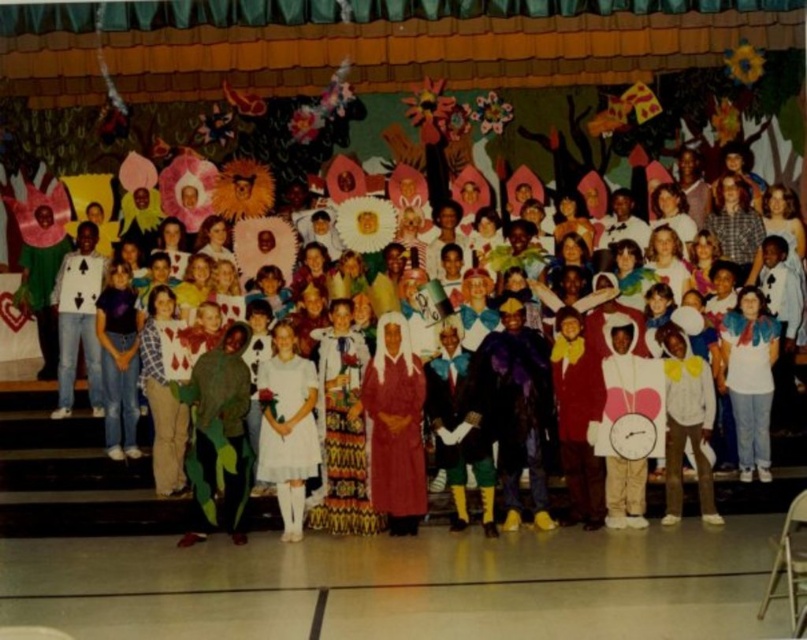
You are a photographer standing at the front of the stage. You want to take a photo of the white cotton dress at center. Where should you aim your camera to capture it?

The white cotton dress at center is located at position point [70,474], so you should aim your camera at that coordinate to capture it.

You are a photographer trying to capture a group photo of the children on stage. You notice two white dresses at the center of the group. Which dress has a wider silhouette? The options are the white cotton dress at center and the white satin dress at center.

The white cotton dress at center has a larger width than the white satin dress at center, so it has a wider silhouette.

You are a photographer standing at the back of the stage. You want to take a photo of both the white cotton dress at center and the white satin dress at center so that they are both clearly visible in the frame. Given their distance apart, is it possible to capture both in a single shot without zooming in?

The white cotton dress at center and the white satin dress at center are 5.34 feet apart. Since they are positioned close enough within the stage, a photographer can likely capture both in a single shot without zooming in, provided the camera has a wide enough lens to accommodate the 5.34 feet distance between them.